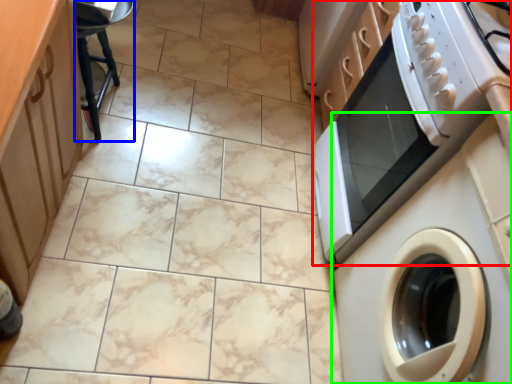
Question: Based on their relative distances, which object is nearer to home appliance (highlighted by a red box)? Choose from bar stool (highlighted by a blue box) and washing machine (highlighted by a green box).

Choices:
 (A) bar stool
 (B) washing machine

Answer: (B)